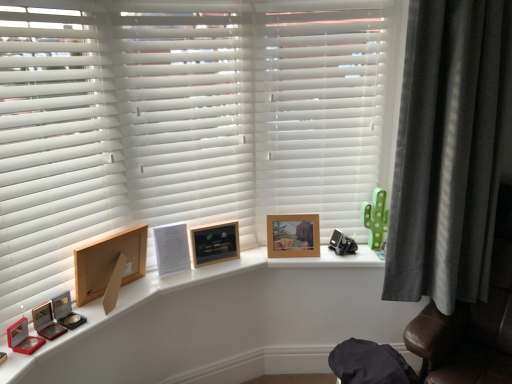
Find the location of a particular element. free space between wooden photo frame at center, which appears as the second picture frame when viewed from the front, and wooden photo frame at center, the first picture frame positioned from the right is located at coordinates (250, 258).